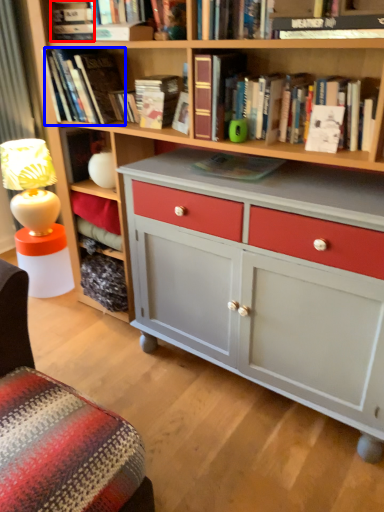
Question: Which object is further to the camera taking this photo, book (highlighted by a red box) or book (highlighted by a blue box)?

Choices:
 (A) book
 (B) book

Answer: (A)